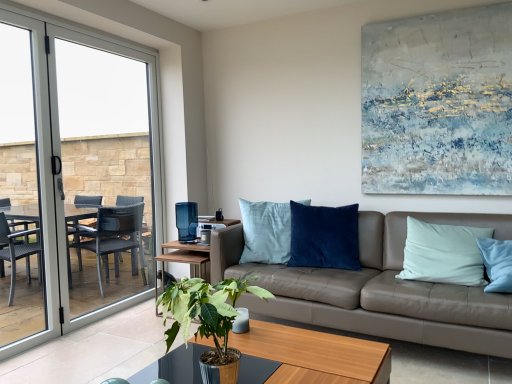
Where is `free spot above clear glass door at left (from a real-world perspective)`? free spot above clear glass door at left (from a real-world perspective) is located at coordinates (106, 42).